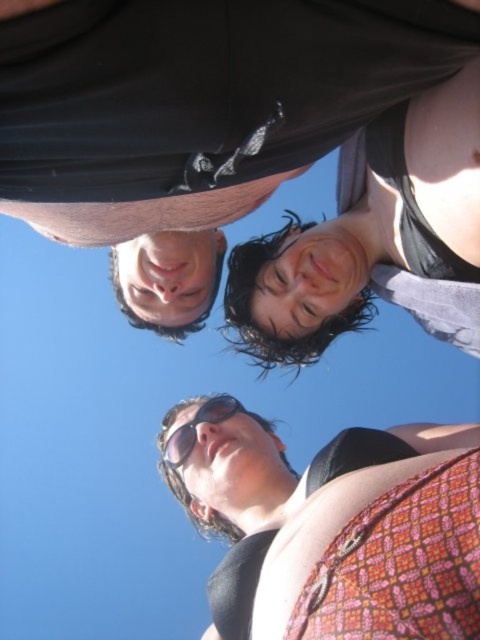
You are standing on the ground and looking up at the scene. Which object is closer to you between the black matte shirt at upper center and the patterned fabric top at lower center?

The patterned fabric top at lower center is closer to you because it is positioned below the black matte shirt at upper center.

You are a photographer trying to adjust your camera to focus on the black matte shirt at upper center. Given the coordinates provided, can you determine if the shirt is positioned exactly in the center of the image?

The black matte shirt at upper center is located at coordinates point [256,147], which means it is not exactly at the center of the image since the center would be at [240,320].